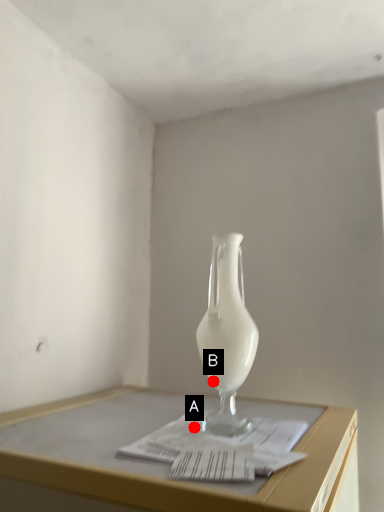
Question: Two points are circled on the image, labeled by A and B beside each circle. Which of the following is the farthest from the observer?

Choices:
 (A) A is further
 (B) B is further

Answer: (B)